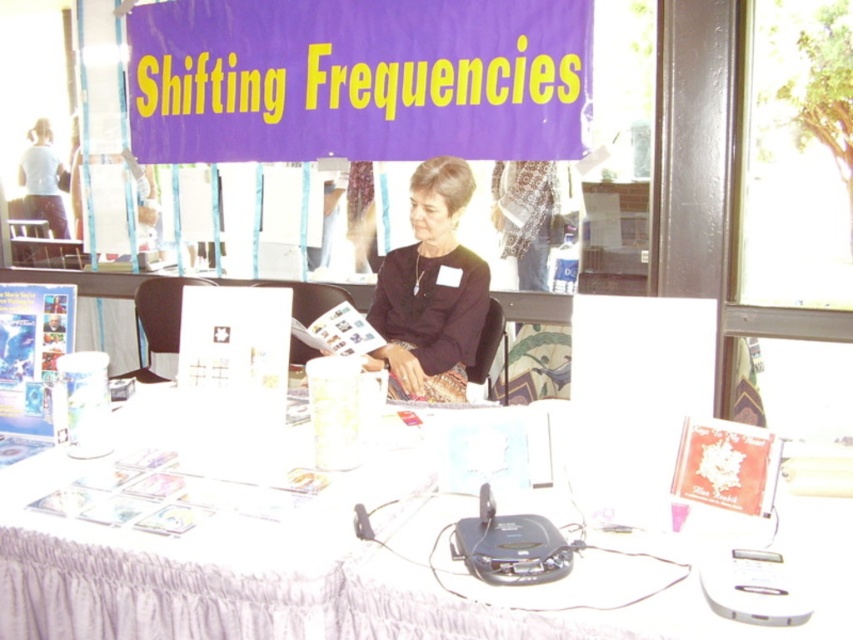
Question: Can you confirm if purple fabric banner at upper center is wider than black matte dress at center?

Choices:
 (A) yes
 (B) no

Answer: (A)

Question: Is the position of purple fabric banner at upper center more distant than that of black matte dress at center?

Choices:
 (A) no
 (B) yes

Answer: (B)

Question: From the image, what is the correct spatial relationship of purple fabric banner at upper center in relation to black matte dress at center?

Choices:
 (A) below
 (B) above

Answer: (B)

Question: Among these objects, which one is farthest from the camera?

Choices:
 (A) purple fabric banner at upper center
 (B) white fabric tablecloth at lower center

Answer: (A)

Question: Among these points, which one is farthest from the camera?

Choices:
 (A) (462, 77)
 (B) (418, 394)
 (C) (165, 417)

Answer: (A)

Question: Which point is closer to the camera taking this photo?

Choices:
 (A) (210, 144)
 (B) (323, 604)
 (C) (389, 365)

Answer: (B)